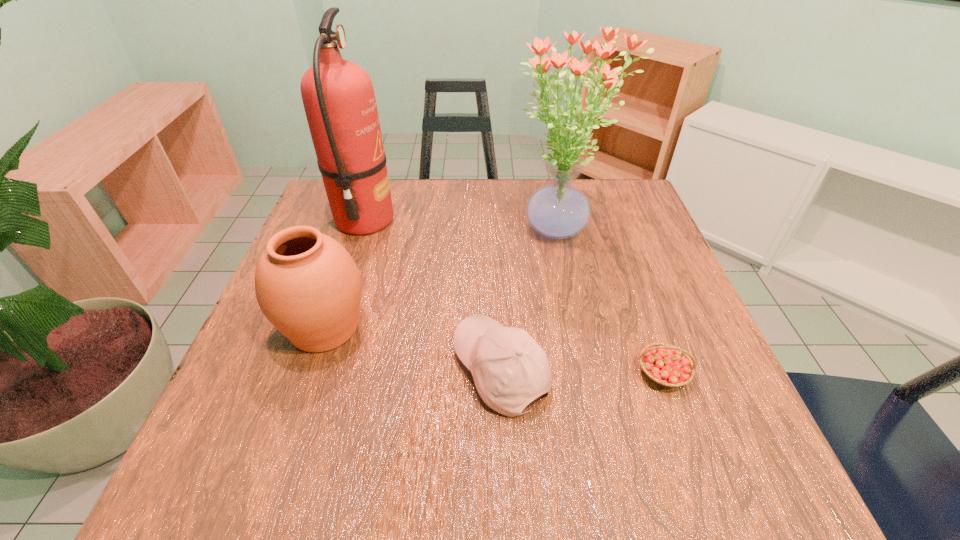
In order to click on vacant space that's between the urn and the baseball cap in this screenshot , I will do `click(413, 349)`.

I want to click on vacant region between the baseball cap and the strawberry, so click(582, 372).

Select which object appears as the second closest to the urn. Please provide its 2D coordinates. Your answer should be formatted as a tuple, i.e. [(x, y)], where the tuple contains the x and y coordinates of a point satisfying the conditions above.

[(509, 368)]

Select which object appears as the third closest to the third shortest object. Please provide its 2D coordinates. Your answer should be formatted as a tuple, i.e. [(x, y)], where the tuple contains the x and y coordinates of a point satisfying the conditions above.

[(558, 210)]

The width and height of the screenshot is (960, 540). In order to click on vacant area in the image that satisfies the following two spatial constraints: 1. on the front-facing side of the shortest object; 2. on the right side of the baseball cap in this screenshot , I will do `click(501, 373)`.

You are a GUI agent. You are given a task and a screenshot of the screen. Output one action in this format:
    pyautogui.click(x=<x>, y=<y>)
    Task: Click on the free space that satisfies the following two spatial constraints: 1. on the side of the fire extinguisher with the nozzle and handle; 2. on the left side of the flower arrangement
    
    Given the screenshot: What is the action you would take?
    pyautogui.click(x=361, y=232)

The height and width of the screenshot is (540, 960). I want to click on vacant point that satisfies the following two spatial constraints: 1. on the front-facing side of the shortest object; 2. on the right side of the baseball cap, so click(501, 373).

This screenshot has height=540, width=960. I want to click on free space that satisfies the following two spatial constraints: 1. on the front side of the strawberry; 2. on the left side of the flower arrangement, so click(588, 373).

Locate an element on the screen. This screenshot has width=960, height=540. vacant area that satisfies the following two spatial constraints: 1. on the side of the fire extinguisher with the nozzle and handle; 2. on the right side of the shortest object is located at coordinates (315, 373).

Image resolution: width=960 pixels, height=540 pixels. In order to click on free location that satisfies the following two spatial constraints: 1. on the front-facing side of the baseball cap; 2. on the right side of the strawberry in this screenshot , I will do `click(501, 373)`.